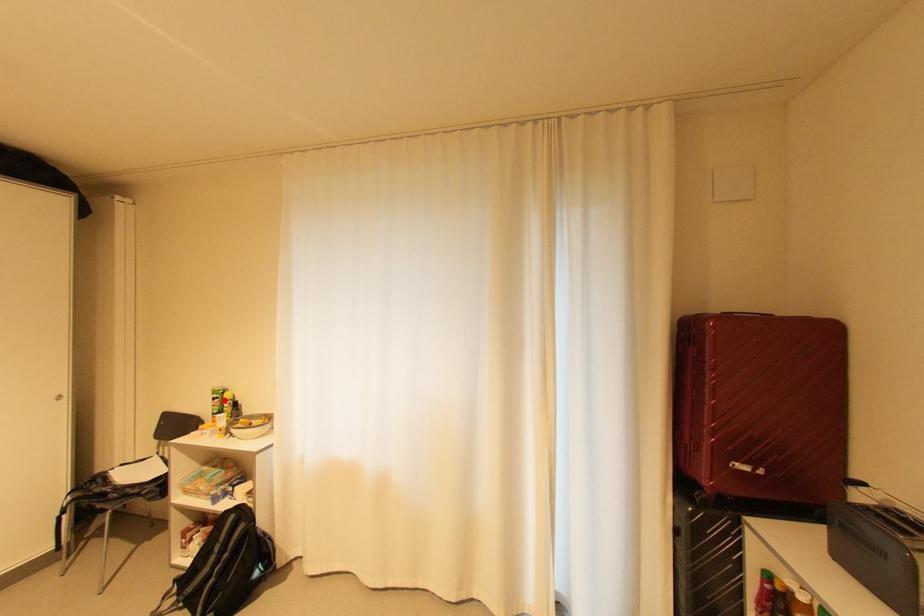
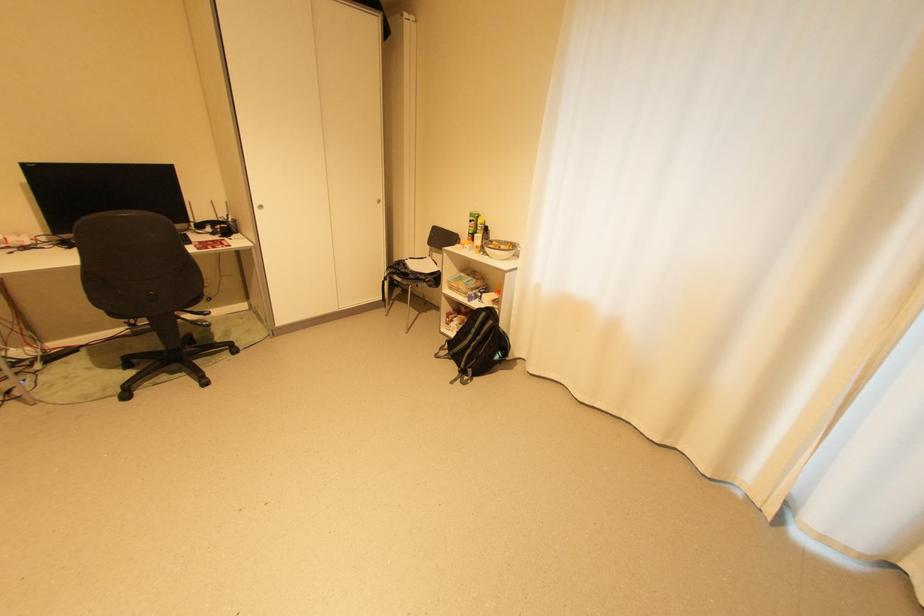
Question: I am providing you with two images of the same scene from different viewpoints. In image1, a red point is highlighted. Considering the same 3D point in image2, which of the following is correct?

Choices:
 (A) It is closer
 (B) It is farther

Answer: (A)